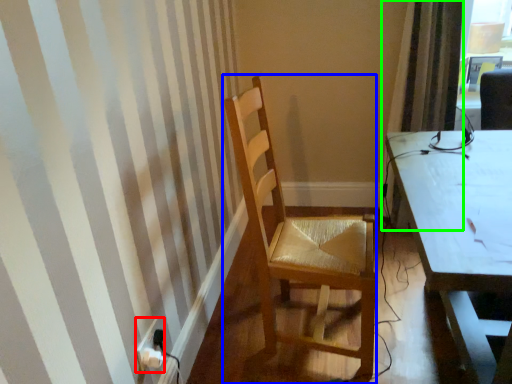
Question: Which object is the closest to the power plugs and sockets (highlighted by a red box)? Choose among these: chair (highlighted by a blue box) or curtain (highlighted by a green box).

Choices:
 (A) chair
 (B) curtain

Answer: (A)